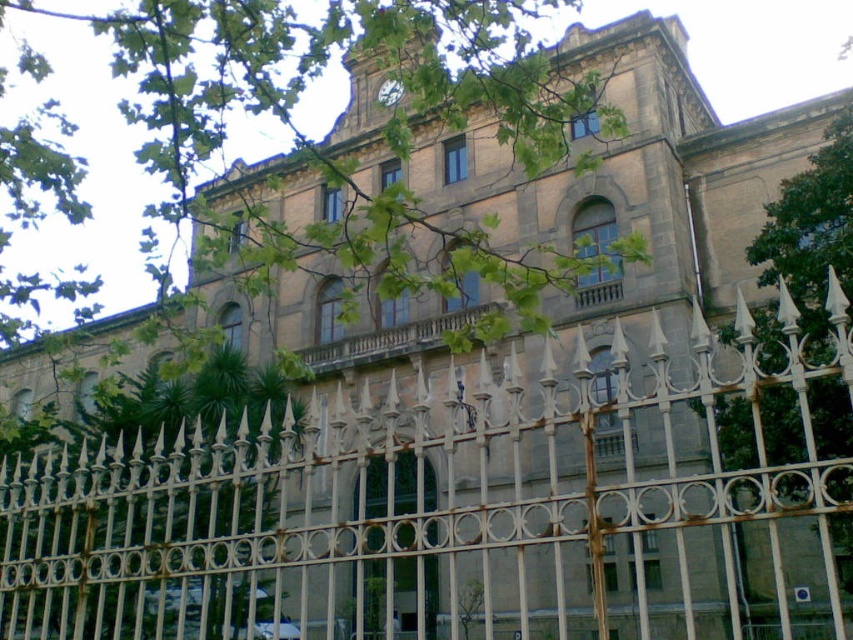
Between rusty metal fence at center and metallic silver clock at upper center, which one has more height?

rusty metal fence at center is taller.

The image size is (853, 640). I want to click on rusty metal fence at center, so click(x=465, y=502).

Where is `rusty metal fence at center`? rusty metal fence at center is located at coordinates (465, 502).

Is rusty metal fence at center to the right of green leafy tree at upper left from the viewer's perspective?

Indeed, rusty metal fence at center is positioned on the right side of green leafy tree at upper left.

Can you confirm if rusty metal fence at center is wider than green leafy tree at upper left?

No.

At what (x,y) coordinates should I click in order to perform the action: click on rusty metal fence at center. Please return your answer as a coordinate pair (x, y). The image size is (853, 640). Looking at the image, I should click on (465, 502).

Does point (518, 29) come behind point (378, 96)?

No.

How much distance is there between green leafy tree at upper left and metallic silver clock at upper center?

green leafy tree at upper left is 25.72 meters from metallic silver clock at upper center.

Identify the location of green leafy tree at upper left. (347, 154).